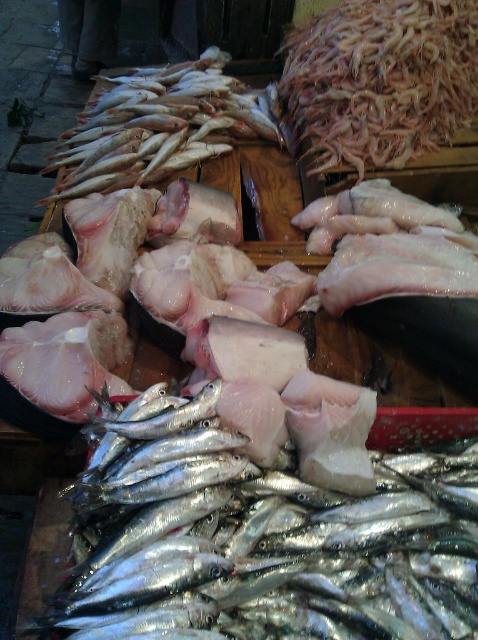
You are a customer at the seafood market and want to buy the shiny silver fish at center and the shiny silver fish at upper left. If you have a small container that can only hold one of them, which fish should you choose to fit in the container?

You should choose the shiny silver fish at center because it occupies less space than the shiny silver fish at upper left, making it more likely to fit in the small container.

Consider the image. Based on the scene description, where exactly is the shiny silver fish at center located in terms of coordinates?

The shiny silver fish at center is located at coordinates point (x=262, y=541).